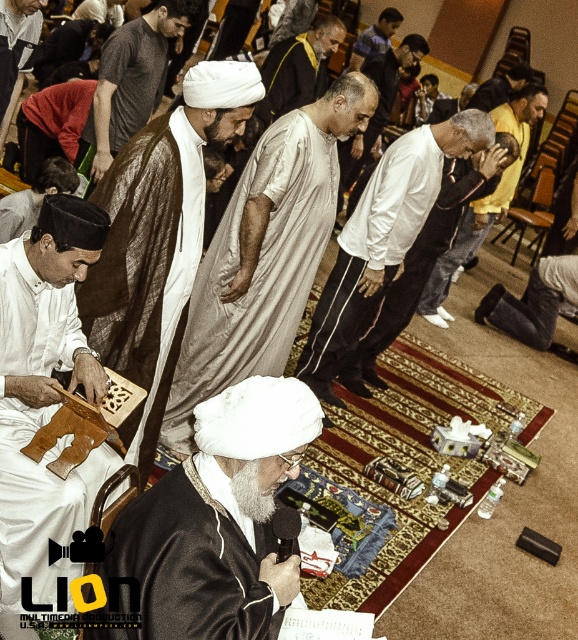
Does white matte cloth at center have a smaller size compared to white fabric turban at upper left?

Actually, white matte cloth at center might be larger than white fabric turban at upper left.

Is white matte cloth at center further to camera compared to white fabric turban at upper left?

Yes, it is behind white fabric turban at upper left.

This screenshot has height=640, width=578. In order to click on white matte cloth at center in this screenshot , I will do `click(381, 241)`.

Locate an element on the screen. The image size is (578, 640). dark gray t-shirt at center is located at coordinates (131, 80).

Can you confirm if dark gray t-shirt at center is positioned to the left of white fabric turban at upper left?

No, dark gray t-shirt at center is not to the left of white fabric turban at upper left.

The image size is (578, 640). Find the location of `dark gray t-shirt at center`. dark gray t-shirt at center is located at coordinates (131, 80).

You are a GUI agent. You are given a task and a screenshot of the screen. Output one action in this format:
    pyautogui.click(x=<x>, y=<y>)
    Task: Click on the dark gray t-shirt at center
    The height and width of the screenshot is (640, 578).
    Given the screenshot: What is the action you would take?
    pyautogui.click(x=131, y=80)

Between white matte cloth at center and blue striped shirt at center, which one is positioned lower?

white matte cloth at center is lower down.

Is point (357, 220) positioned after point (395, 17)?

That is False.

This screenshot has width=578, height=640. I want to click on white matte cloth at center, so click(x=381, y=241).